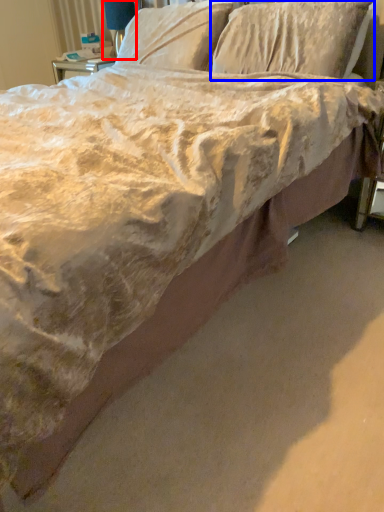
Question: Which of the following is the farthest to the observer, table lamp (highlighted by a red box) or pillow (highlighted by a blue box)?

Choices:
 (A) table lamp
 (B) pillow

Answer: (A)